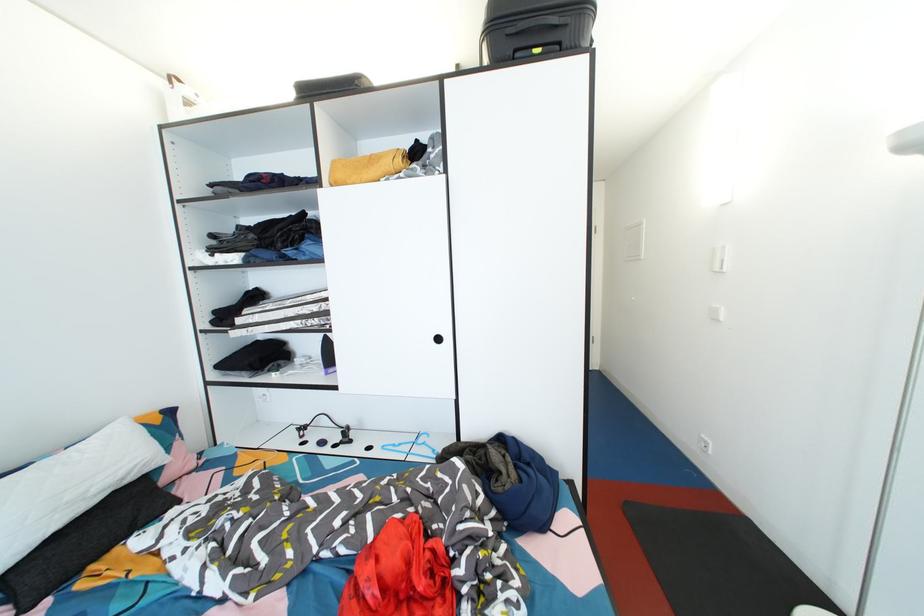
This screenshot has width=924, height=616. Find the location of `black iron`. black iron is located at coordinates (535, 28).